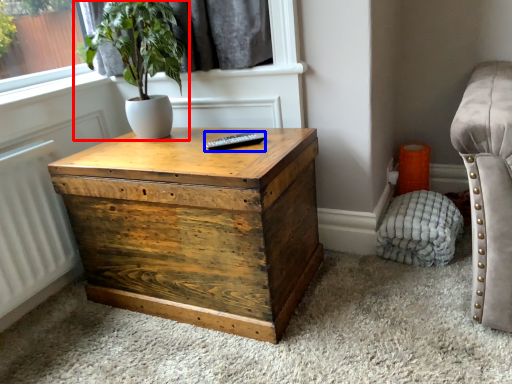
Question: Which object is closer to the camera taking this photo, houseplant (highlighted by a red box) or remote (highlighted by a blue box)?

Choices:
 (A) houseplant
 (B) remote

Answer: (A)